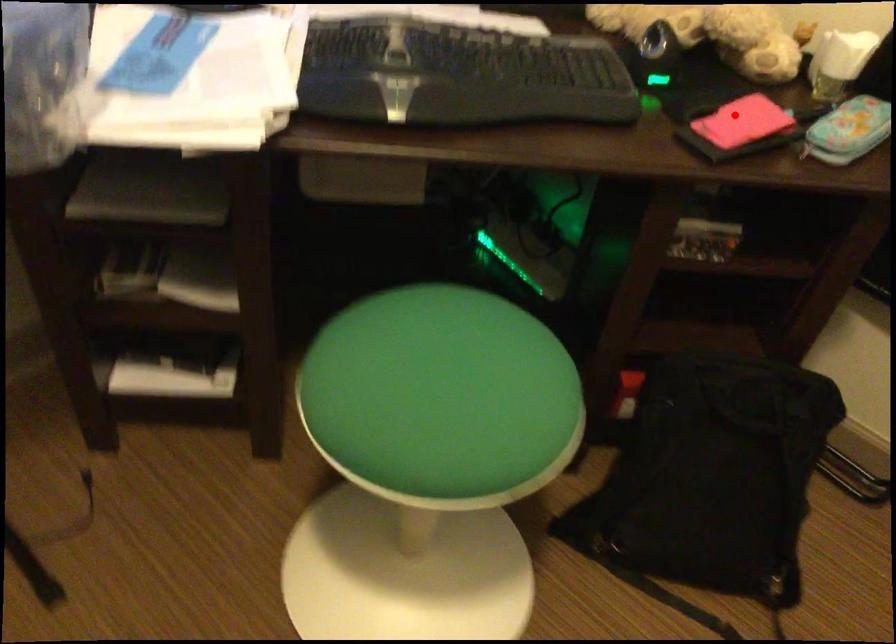
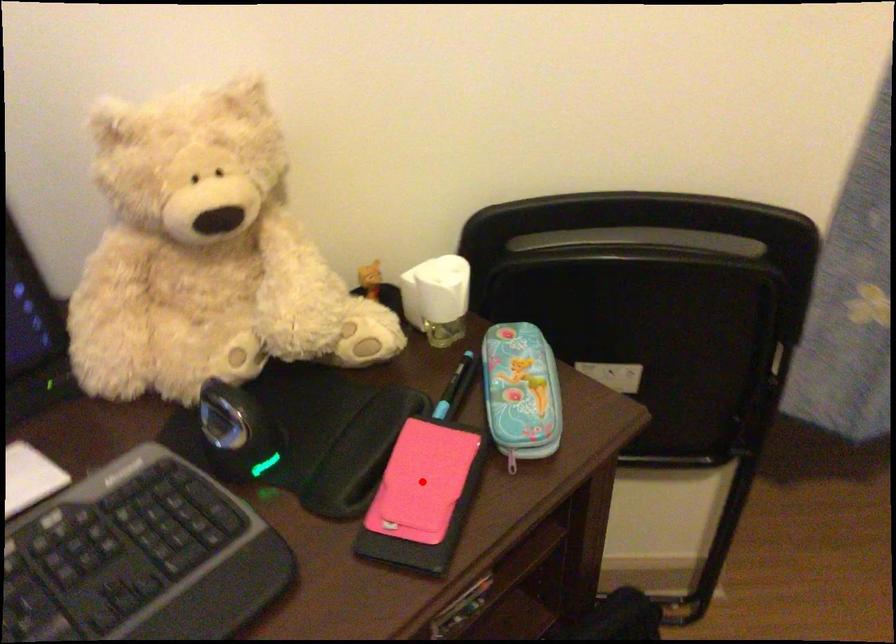
I am providing you with two images of the same scene from different viewpoints. A red point is marked on the first image and another point is marked on the second image. Does the point marked in image1 correspond to the same location as the one in image2?

Yes